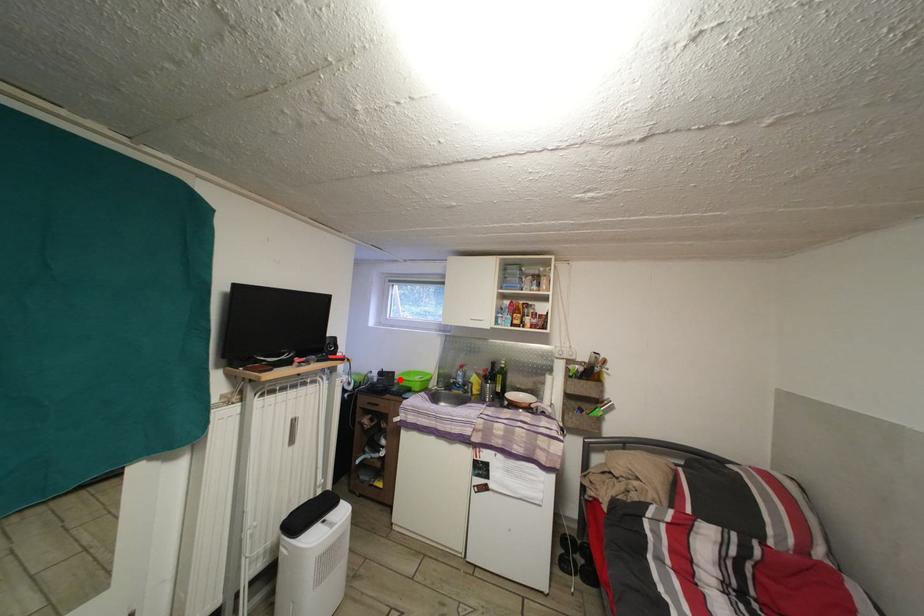
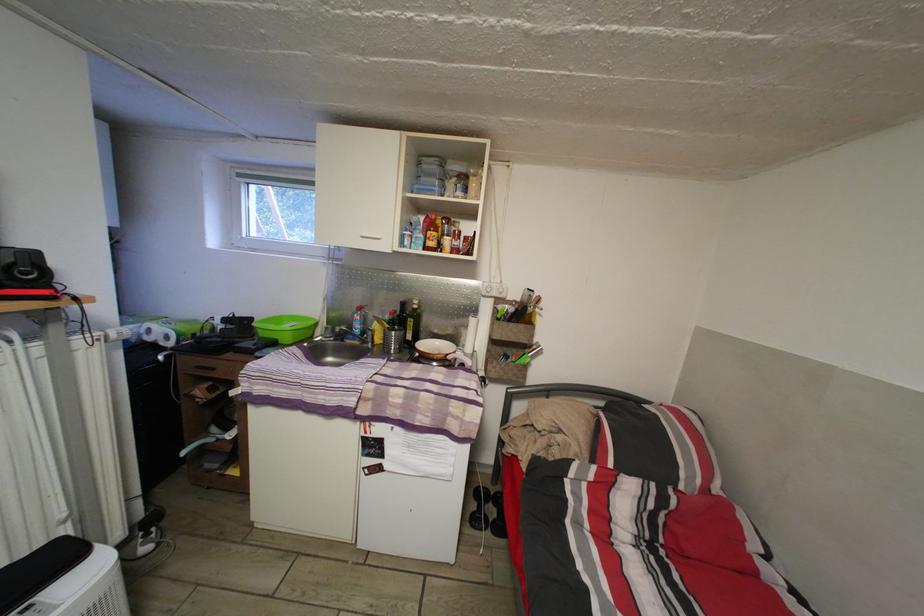
Where in the second image is the point corresponding to the highlighted location from the first image?

(257, 326)